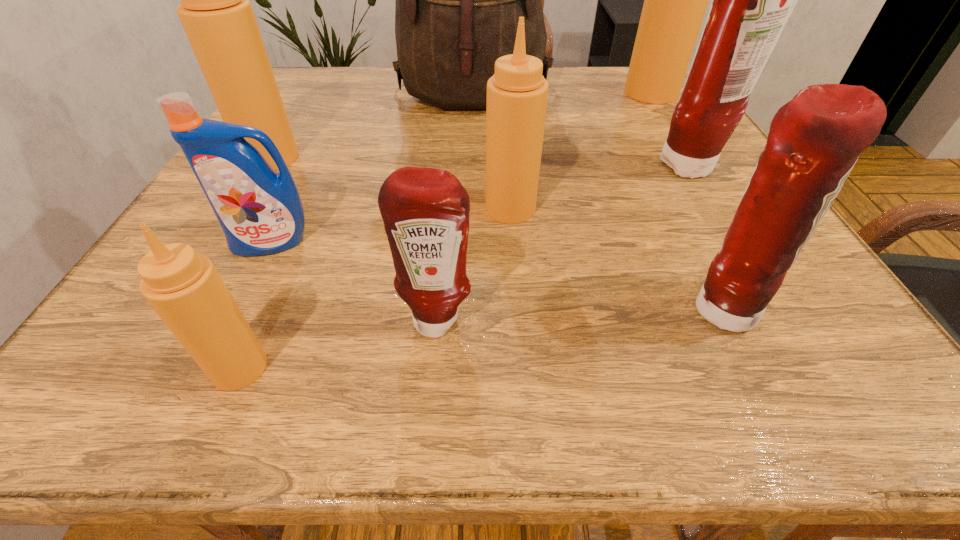
Locate an element on the screen. The height and width of the screenshot is (540, 960). vacant region between the fourth condiment from right to left and the third condiment from left to right is located at coordinates (473, 264).

At what (x,y) coordinates should I click in order to perform the action: click on vacant space in between the second smallest tan condiment and the nearest tan condiment. Please return your answer as a coordinate pair (x, y). Looking at the image, I should click on (375, 288).

Choose which object is the sixth nearest neighbor to the detergent. Please provide its 2D coordinates. Your answer should be formatted as a tuple, i.e. [(x, y)], where the tuple contains the x and y coordinates of a point satisfying the conditions above.

[(814, 141)]

Identify which object is located as the seventh nearest to the leftmost red condiment. Please provide its 2D coordinates. Your answer should be formatted as a tuple, i.e. [(x, y)], where the tuple contains the x and y coordinates of a point satisfying the conditions above.

[(458, 0)]

Where is `condiment that is the fourth closest to the second farthest tan condiment`? This screenshot has height=540, width=960. condiment that is the fourth closest to the second farthest tan condiment is located at coordinates (814, 141).

Point out which condiment is positioned as the sixth nearest to the nearest condiment. Please provide its 2D coordinates. Your answer should be formatted as a tuple, i.e. [(x, y)], where the tuple contains the x and y coordinates of a point satisfying the conditions above.

[(675, 0)]

Locate an element on the screen. The image size is (960, 540). tan condiment that can be found as the second closest to the leftmost tan condiment is located at coordinates (184, 288).

Where is `tan condiment that can be found as the third closest to the backpack`? tan condiment that can be found as the third closest to the backpack is located at coordinates (517, 93).

Select which red condiment is the closest to the third condiment from left to right. Please provide its 2D coordinates. Your answer should be formatted as a tuple, i.e. [(x, y)], where the tuple contains the x and y coordinates of a point satisfying the conditions above.

[(814, 141)]

I want to click on red condiment that is the third closest one to the tallest condiment, so click(x=425, y=211).